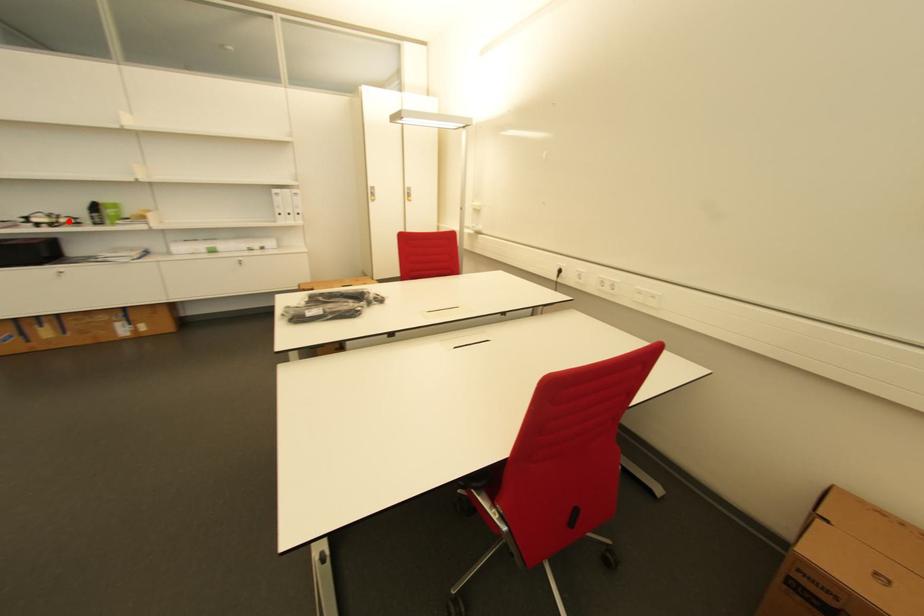
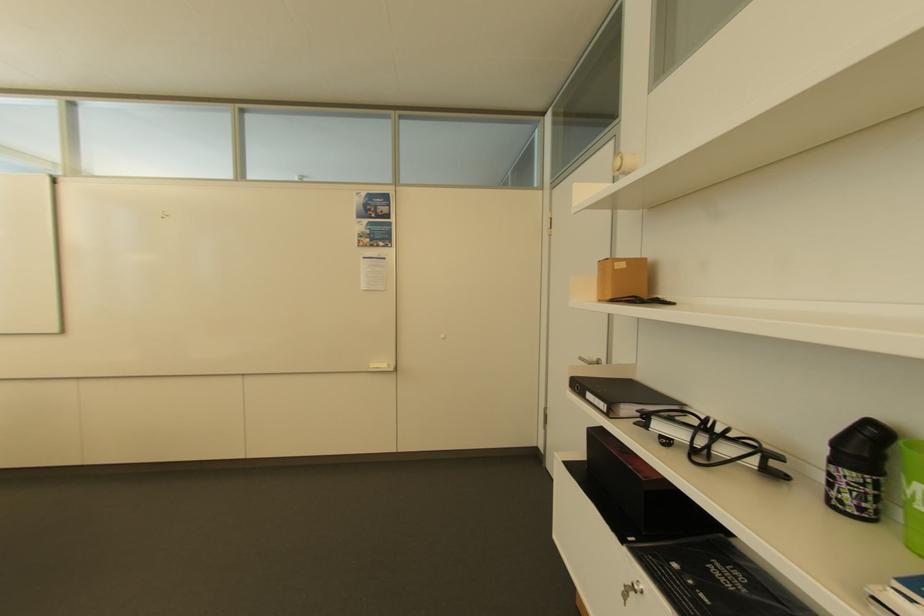
Find the pixel in the second image that matches the highlighted location in the first image.

(728, 452)